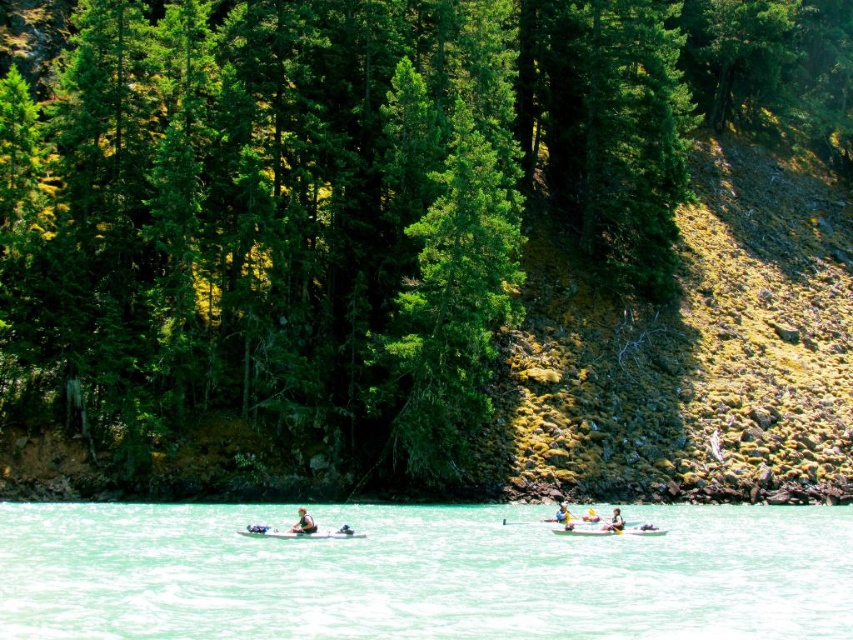
Is point (614, 508) more distant than point (567, 513)?

That is True.

Can you confirm if light brown wooden paddle at center is thinner than yellow fabric kayak at center?

Incorrect, light brown wooden paddle at center's width is not less than yellow fabric kayak at center's.

Who is more distant from viewer, (607,525) or (567,524)?

The point (567,524) is more distant.

Locate an element on the screen. light brown wooden paddle at center is located at coordinates (614, 522).

Is white fabric kayak at center below yellow fabric kayak at center?

Actually, white fabric kayak at center is above yellow fabric kayak at center.

Image resolution: width=853 pixels, height=640 pixels. What do you see at coordinates (303, 522) in the screenshot? I see `white fabric kayak at center` at bounding box center [303, 522].

Between point (299, 532) and point (563, 506), which one is positioned behind?

The point (563, 506) is behind.

Image resolution: width=853 pixels, height=640 pixels. Identify the location of white fabric kayak at center. (303, 522).

Which of these two, white plastic kayak at center or light brown wooden paddle at center, stands taller?

With more height is light brown wooden paddle at center.

Can you confirm if white plastic kayak at center is smaller than light brown wooden paddle at center?

Yes.

The width and height of the screenshot is (853, 640). What do you see at coordinates (608, 531) in the screenshot? I see `white plastic kayak at center` at bounding box center [608, 531].

Identify the location of white plastic kayak at center. (608, 531).